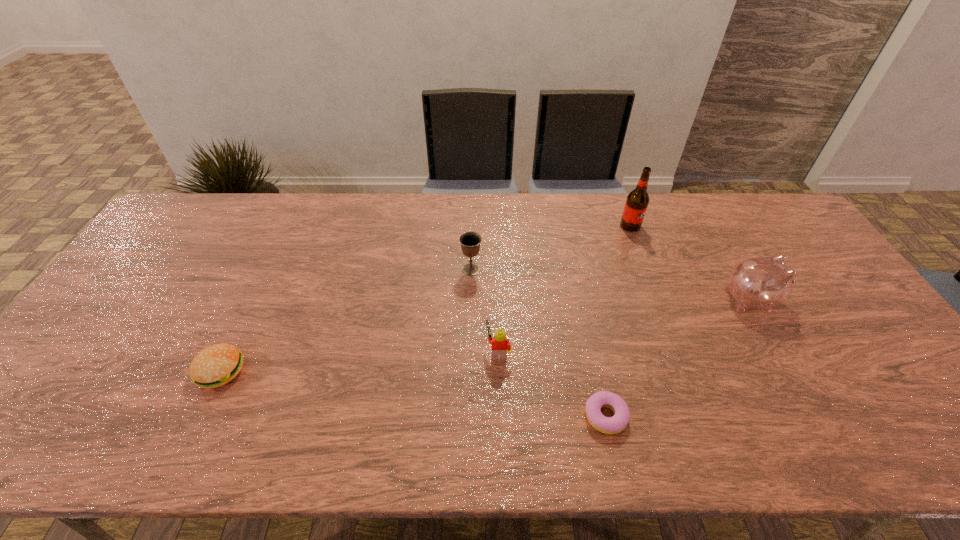
Where is `the tallest object`? the tallest object is located at coordinates (637, 201).

This screenshot has width=960, height=540. In order to click on root beer in this screenshot , I will do `click(637, 201)`.

Where is `piggy bank`? The width and height of the screenshot is (960, 540). piggy bank is located at coordinates (763, 283).

The image size is (960, 540). In order to click on the second tallest object in this screenshot , I will do `click(763, 283)`.

The image size is (960, 540). Identify the location of the fifth object from right to left. (470, 241).

The width and height of the screenshot is (960, 540). I want to click on chalice, so [x=470, y=241].

The image size is (960, 540). Identify the location of the fourth tallest object. (501, 345).

At what (x,y) coordinates should I click in order to perform the action: click on the third object from left to right. Please return your answer as a coordinate pair (x, y). This screenshot has height=540, width=960. Looking at the image, I should click on (501, 345).

At what (x,y) coordinates should I click in order to perform the action: click on patty. Please return your answer as a coordinate pair (x, y). Image resolution: width=960 pixels, height=540 pixels. Looking at the image, I should click on (216, 365).

In order to click on the leftmost object in this screenshot , I will do `click(216, 365)`.